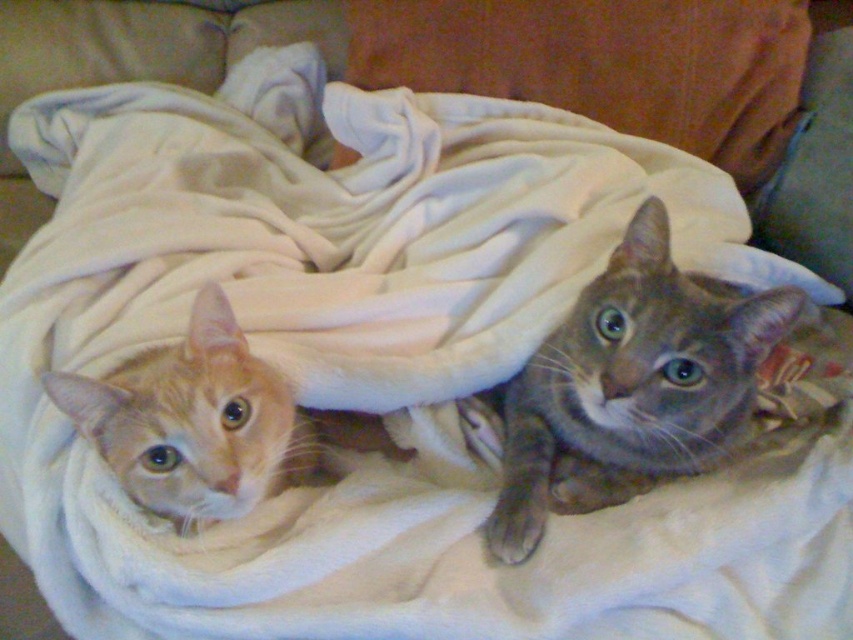
You are a photographer setting up a shoot with two cats. You need to position a small toy between them so that it is equidistant from both. Given their positions, where should you place the toy relative to the orange fur cat at left and the gray soft fur cat at upper right?

The toy should be placed exactly halfway between the orange fur cat at left and the gray soft fur cat at upper right since the gray soft fur cat at upper right is positioned to the right of the orange fur cat at left.

You are a photographer trying to capture a closeup shot of both the gray soft fur cat at upper right and the orange fur cat at left. Given that your camera lens has a maximum focus range of 10 inches, will you be able to focus on both cats simultaneously?

The distance between the gray soft fur cat at upper right and orange fur cat at left is 10.21 inches. Since the camera lens has a maximum focus range of 10 inches, it will not be able to focus on both cats simultaneously as the distance exceeds the limit.

You are a photographer setting up a shoot with two cats on a blanket. The cats are the gray soft fur cat at upper right and the gray fur cat at center. Which cat is located below the other?

The gray soft fur cat at upper right is positioned under the gray fur cat at center, so the gray soft fur cat at upper right is below the gray fur cat at center.